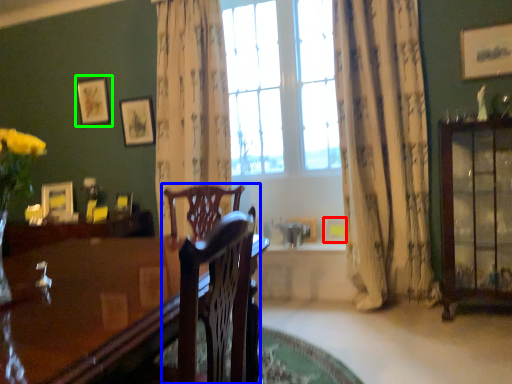
Question: Considering the real-world distances, which object is closest to picture frame (highlighted by a red box)? chair (highlighted by a blue box) or picture frame (highlighted by a green box).

Choices:
 (A) chair
 (B) picture frame

Answer: (A)